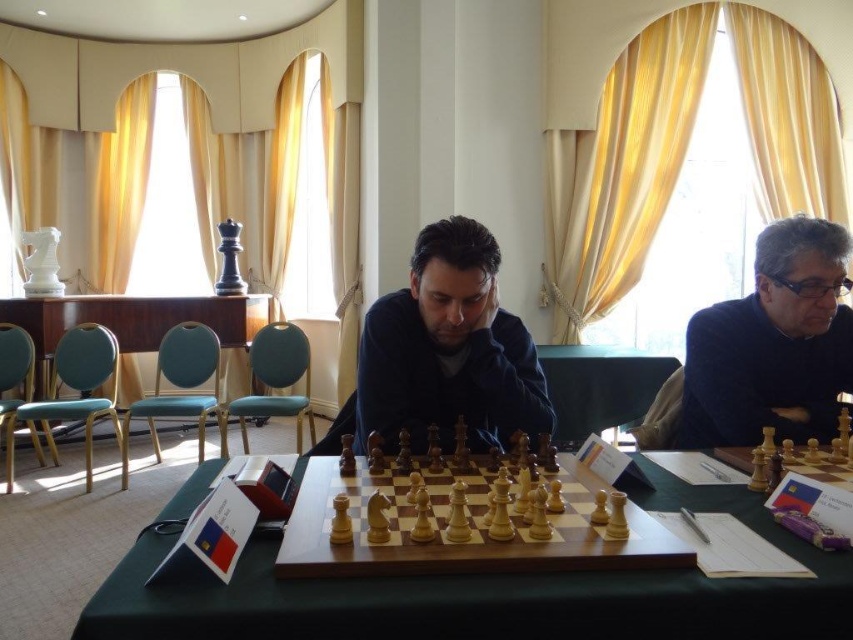
Measure the distance between green felt table at center and wooden at center.

green felt table at center and wooden at center are 3.89 meters apart.

Is green felt table at center shorter than wooden at center?

Yes, green felt table at center is shorter than wooden at center.

Is point (570, 600) in front of point (248, 310)?

Yes, point (570, 600) is closer to viewer.

You are a GUI agent. You are given a task and a screenshot of the screen. Output one action in this format:
    pyautogui.click(x=<x>, y=<y>)
    Task: Click on the green felt table at center
    Image resolution: width=853 pixels, height=640 pixels.
    Given the screenshot: What is the action you would take?
    (488, 596)

Can you confirm if dark blue sweater at center is positioned above wooden at center?

No, dark blue sweater at center is not above wooden at center.

Describe the element at coordinates (448, 349) in the screenshot. The width and height of the screenshot is (853, 640). I see `dark blue sweater at center` at that location.

Find the location of a particular element. The height and width of the screenshot is (640, 853). dark blue sweater at center is located at coordinates (448, 349).

Is point (368, 376) closer to viewer compared to point (489, 528)?

No, it is not.

Is the position of dark blue sweater at center less distant than that of wooden chessboard at center?

No, dark blue sweater at center is behind wooden chessboard at center.

Who is more forward, [432,412] or [541,492]?

Positioned in front is point [541,492].

Locate an element on the screen. dark blue sweater at center is located at coordinates (448, 349).